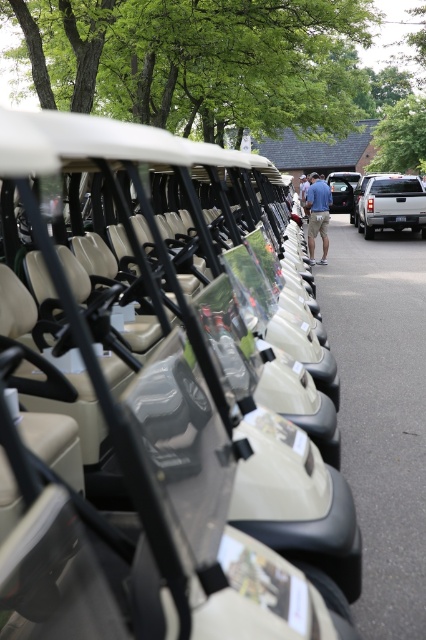
You are a visitor at the golf course and need to walk to the registration desk located behind the silver metallic truck at right. You are currently standing in front of the beige matte golf cart at center. Can you walk directly to the registration desk without moving around any obstacles?

The beige matte golf cart at center is in front of the silver metallic truck at right, so you cannot walk directly to the registration desk behind the silver metallic truck at right without moving around the beige matte golf cart at center first.